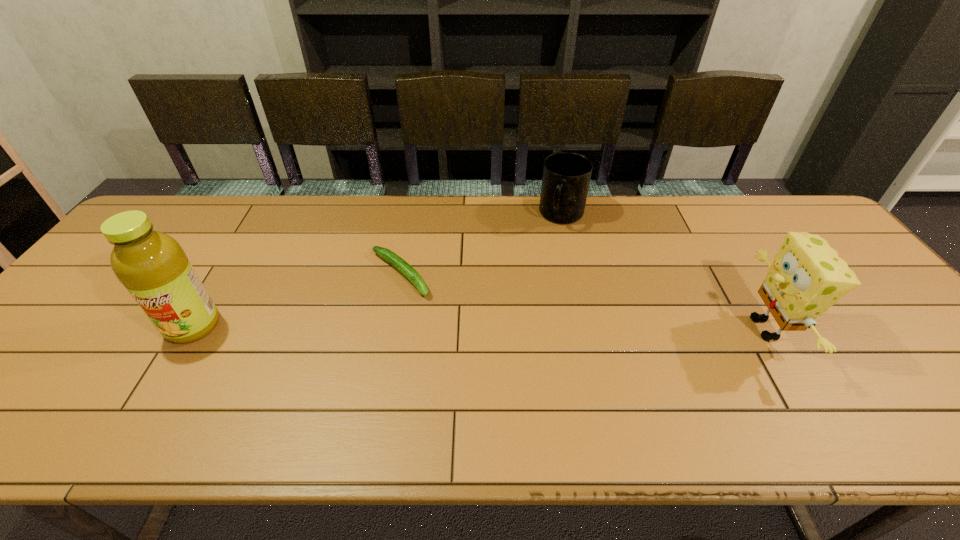
Where is `free space located 0.080m on the face of the rightmost object`? This screenshot has height=540, width=960. free space located 0.080m on the face of the rightmost object is located at coordinates (709, 328).

Find the location of `blank area located on the face of the rightmost object`. blank area located on the face of the rightmost object is located at coordinates (673, 328).

What are the coordinates of `vacant region located 0.400m on the front-facing side of the zucchini` in the screenshot? It's located at (528, 393).

You are a GUI agent. You are given a task and a screenshot of the screen. Output one action in this format:
    pyautogui.click(x=<x>, y=<y>)
    Task: Click on the vacant space situated on the front-facing side of the zucchini
    
    Given the screenshot: What is the action you would take?
    pyautogui.click(x=455, y=326)

You are a GUI agent. You are given a task and a screenshot of the screen. Output one action in this format:
    pyautogui.click(x=<x>, y=<y>)
    Task: Click on the blank area located on the front-facing side of the zucchini
    
    Given the screenshot: What is the action you would take?
    pyautogui.click(x=444, y=317)

In order to click on vacant space located 0.200m on the side of the second object from right to left with the handle in this screenshot , I will do `click(539, 274)`.

Locate an element on the screen. vacant space situated 0.140m on the side of the second object from right to left with the handle is located at coordinates (544, 260).

Locate an element on the screen. free space located on the side of the second object from right to left with the handle is located at coordinates (523, 308).

I want to click on object at the far edge, so point(566,177).

Locate an element on the screen. Image resolution: width=960 pixels, height=540 pixels. object that is positioned at the near edge is located at coordinates (807, 276).